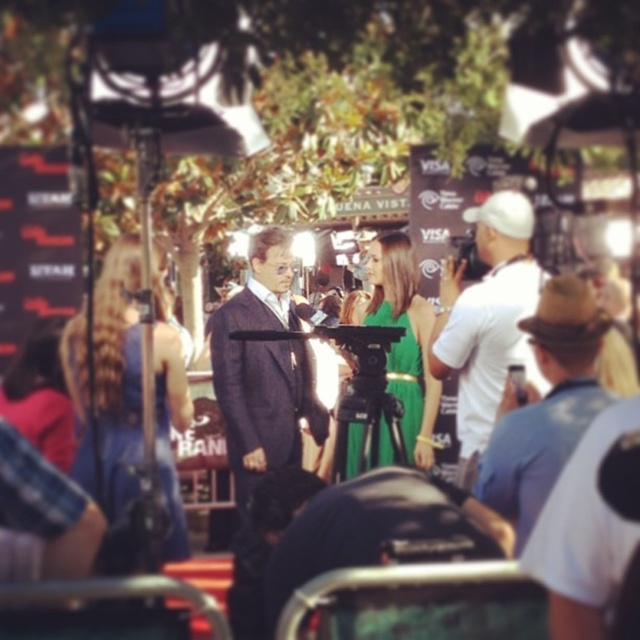
Can you confirm if white cotton shirt at right is wider than brown felt hat at upper right?

No, white cotton shirt at right is not wider than brown felt hat at upper right.

Find the location of a particular element. The image size is (640, 640). white cotton shirt at right is located at coordinates (486, 320).

Is textured navy suit at center to the right of white cotton shirt at right from the viewer's perspective?

Incorrect, textured navy suit at center is not on the right side of white cotton shirt at right.

In the scene shown: Between textured navy suit at center and white cotton shirt at right, which one appears on the right side from the viewer's perspective?

white cotton shirt at right

Where is `textured navy suit at center`? textured navy suit at center is located at coordinates (262, 371).

Is textured navy suit at center bigger than brown felt hat at upper right?

No.

Is textured navy suit at center further to the viewer compared to brown felt hat at upper right?

Yes, it is behind brown felt hat at upper right.

Locate an element on the screen. This screenshot has height=640, width=640. textured navy suit at center is located at coordinates (262, 371).